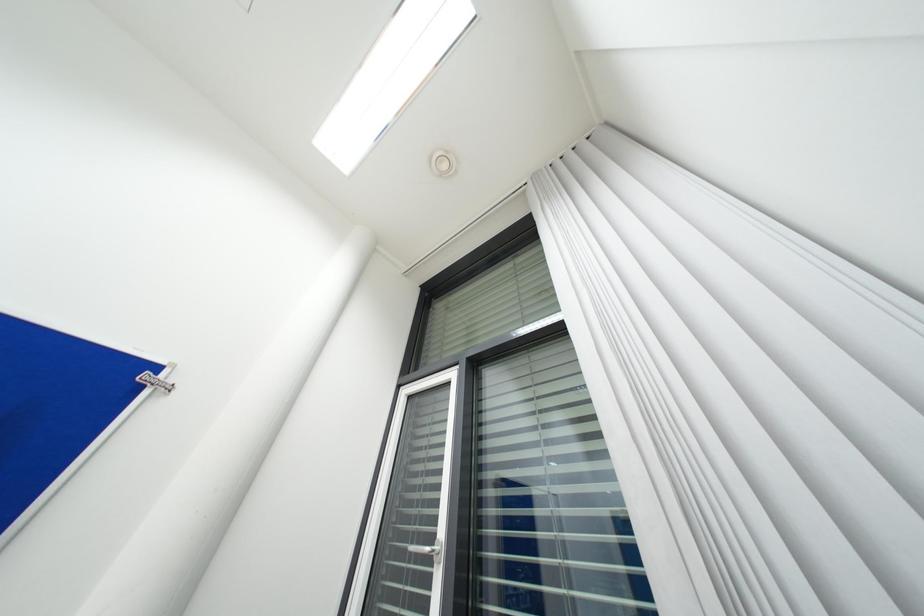
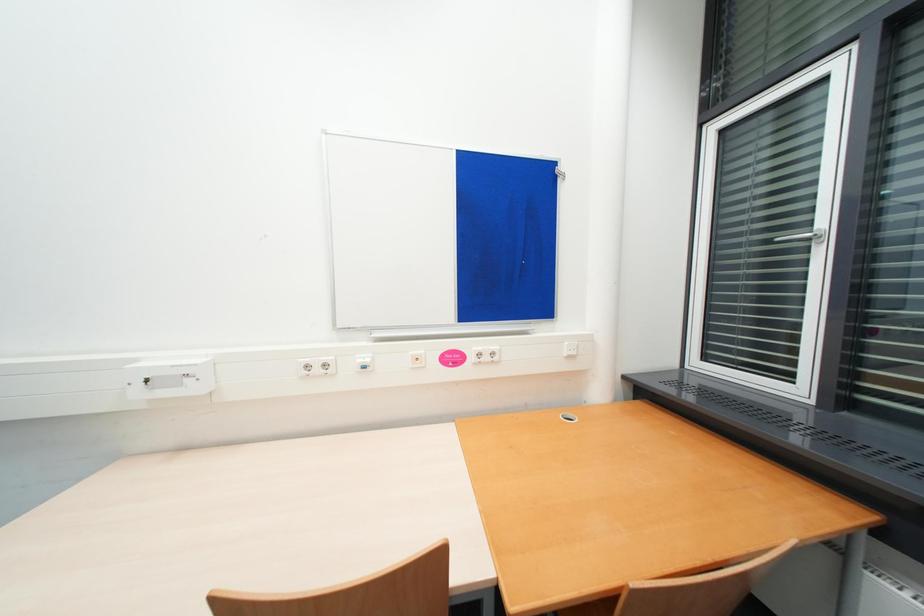
The images are taken continuously from a first-person perspective. In which direction is your viewpoint rotating?

The camera's rotation is toward left-down.